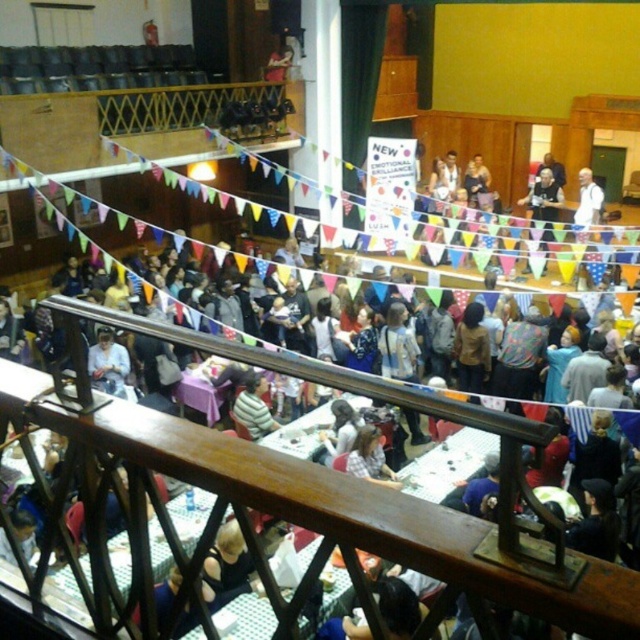
You are standing at the railing on the upper level of the hall. You see a striped shirt at center and a white shirt at upper right. Which shirt is closer to you?

The striped shirt at center is closer to you since it is only 8.05 meters away from the white shirt at upper right, but since the white shirt is at upper right, it might be positioned further away in the upper part of the hall.